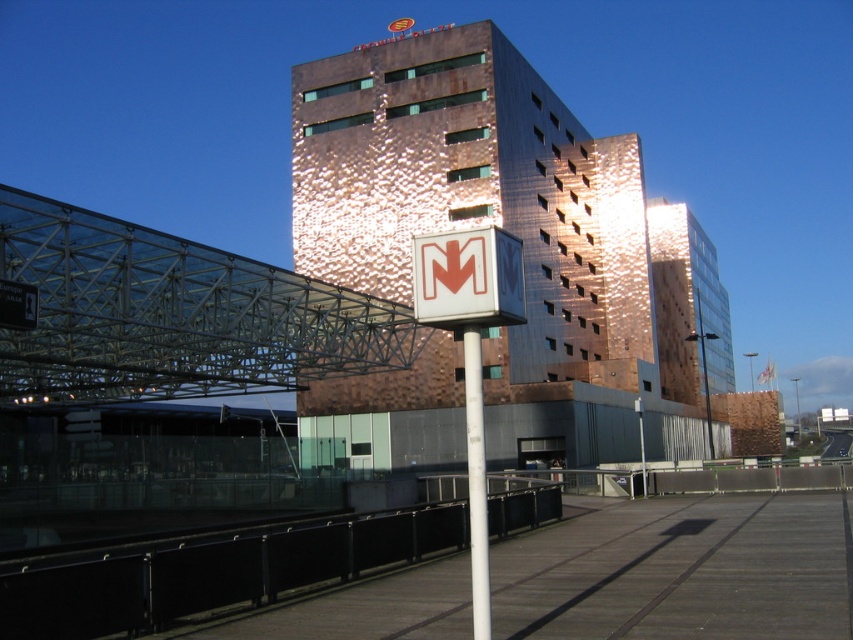
Question: Estimate the real-world distances between objects in this image. Which object is farther from the copper textured building at center?

Choices:
 (A) white plastic sign at center
 (B) copper hammered metal building at center
 (C) white glossy pole at center

Answer: (A)

Question: Which object is positioned farthest from the white plastic sign at center?

Choices:
 (A) white glossy pole at center
 (B) copper textured building at center

Answer: (B)

Question: Which object appears farthest from the camera in this image?

Choices:
 (A) copper hammered metal building at center
 (B) copper textured building at center
 (C) white plastic sign at center

Answer: (B)

Question: Can you confirm if copper textured building at center is bigger than white glossy pole at center?

Choices:
 (A) yes
 (B) no

Answer: (A)

Question: Does white plastic sign at center have a greater width compared to white glossy pole at center?

Choices:
 (A) yes
 (B) no

Answer: (B)

Question: Is copper hammered metal building at center positioned at the back of white glossy pole at center?

Choices:
 (A) no
 (B) yes

Answer: (B)